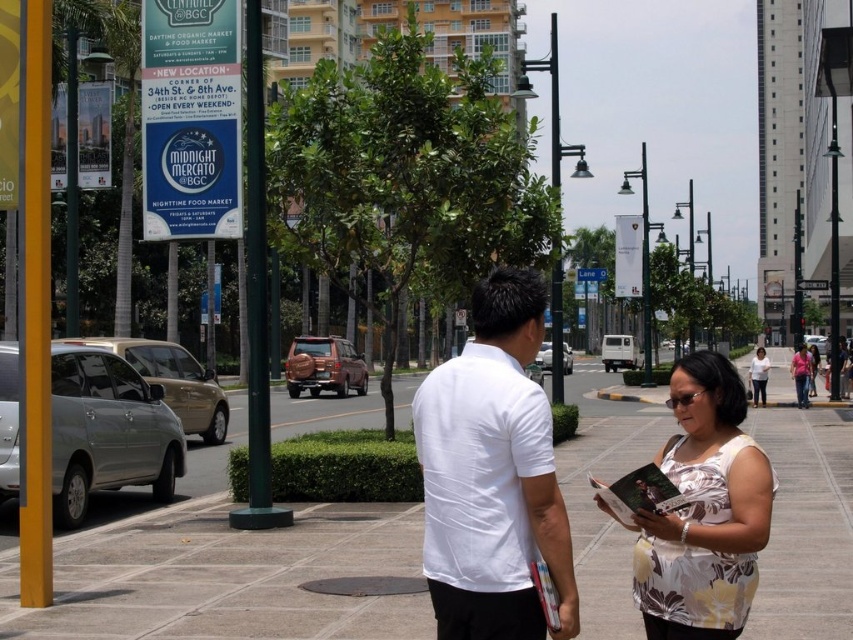
You are standing at point (791, 360) and want to walk to point (598, 467). Which direction should you move relative to your current position?

You should move forward because point (598, 467) is in front of point (791, 360).

You are a city planner analyzing the urban street scene. You need to determine which object occupies more space in the image between the gray concrete pavement at center and the blue plastic sign at center. Which one is larger?

The blue plastic sign at center is larger than the gray concrete pavement at center, as the gray concrete pavement at center has a smaller size compared to the blue plastic sign at center.

You are a delivery person trying to place a package on the gray concrete pavement at center and the blue plastic sign at center. Which object should you place the package on if you want it closer to the left side of the scene?

You should place the package on the gray concrete pavement at center because it is located to the left of the blue plastic sign at center.